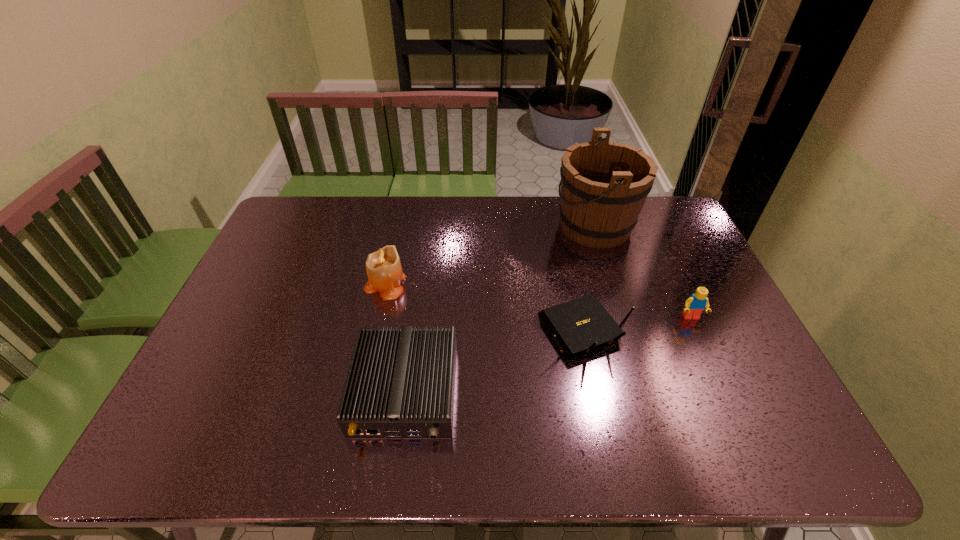
Where is `free space that satisfies the following two spatial constraints: 1. on the side of the tallest object with the handle for carrying; 2. on the front side of the right router`? This screenshot has height=540, width=960. free space that satisfies the following two spatial constraints: 1. on the side of the tallest object with the handle for carrying; 2. on the front side of the right router is located at coordinates (627, 330).

Find the location of `vacant point that satisfies the following two spatial constraints: 1. on the side of the tallest object with the handle for carrying; 2. on the back panel of the left router`. vacant point that satisfies the following two spatial constraints: 1. on the side of the tallest object with the handle for carrying; 2. on the back panel of the left router is located at coordinates (646, 390).

Where is `blank space that satisfies the following two spatial constraints: 1. on the side of the farthest object with the handle for carrying; 2. on the back panel of the left router`? Image resolution: width=960 pixels, height=540 pixels. blank space that satisfies the following two spatial constraints: 1. on the side of the farthest object with the handle for carrying; 2. on the back panel of the left router is located at coordinates point(646,390).